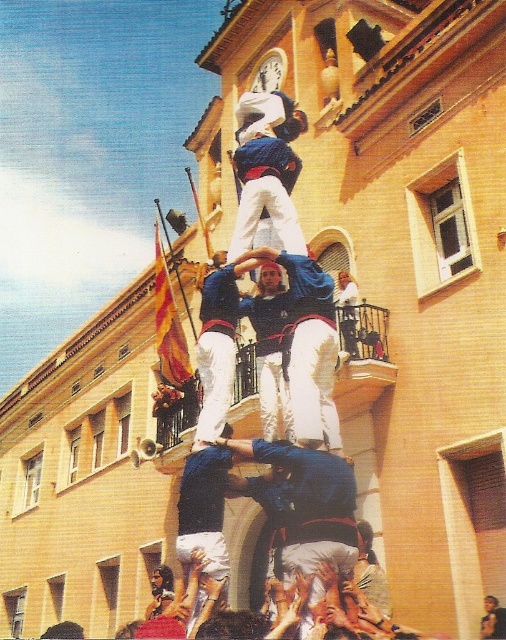
Question: Among these objects, which one is nearest to the camera?

Choices:
 (A) blue fabric shirt at center
 (B) blue denim jeans at center

Answer: (A)

Question: Can you confirm if blue fabric shirt at center is thinner than blue denim jeans at center?

Choices:
 (A) yes
 (B) no

Answer: (B)

Question: Is blue fabric shirt at center positioned before blue denim jeans at center?

Choices:
 (A) yes
 (B) no

Answer: (A)

Question: Is blue fabric shirt at center behind blue denim jeans at center?

Choices:
 (A) no
 (B) yes

Answer: (A)